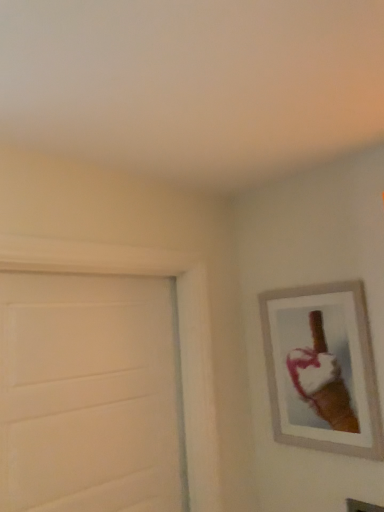
Question: Relative to wooden picture frame at upper right, is white matte door at left in front or behind?

Choices:
 (A) front
 (B) behind

Answer: (A)

Question: From the image's perspective, relative to wooden picture frame at upper right, is white matte door at left above or below?

Choices:
 (A) above
 (B) below

Answer: (B)

Question: Considering the relative positions of white matte door at left and wooden picture frame at upper right in the image provided, is white matte door at left to the left or to the right of wooden picture frame at upper right?

Choices:
 (A) right
 (B) left

Answer: (B)

Question: From a real-world perspective, is wooden picture frame at upper right physically located above or below white matte door at left?

Choices:
 (A) below
 (B) above

Answer: (B)

Question: Considering their positions, is wooden picture frame at upper right located in front of or behind white matte door at left?

Choices:
 (A) behind
 (B) front

Answer: (A)

Question: Is point (264, 308) positioned closer to the camera than point (119, 312)?

Choices:
 (A) closer
 (B) farther

Answer: (B)

Question: In terms of height, does wooden picture frame at upper right look taller or shorter compared to white matte door at left?

Choices:
 (A) short
 (B) tall

Answer: (A)